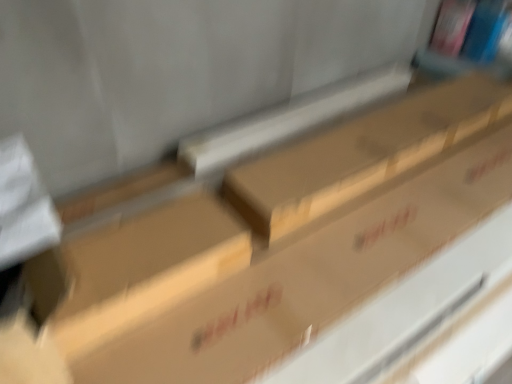
Where is `vacant area that is in front of brown cardboard box at center`? vacant area that is in front of brown cardboard box at center is located at coordinates (162, 348).